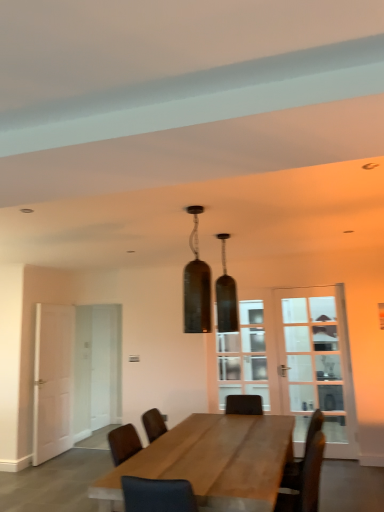
Question: Can you confirm if white glass door at left, which appears as the 1th glass door when viewed from the back, is thinner than matte glass pendant light at center, the 2th lamp in the front-to-back sequence?

Choices:
 (A) yes
 (B) no

Answer: (A)

Question: From the image's perspective, is white glass door at left, which appears as the first glass door when viewed from the left, on matte glass pendant light at center, marked as the 1th lamp in a back-to-front arrangement?

Choices:
 (A) yes
 (B) no

Answer: (B)

Question: From a real-world perspective, is white glass door at left, which is the 2th glass door from front to back, physically above matte glass pendant light at center, the 2th lamp in the front-to-back sequence?

Choices:
 (A) yes
 (B) no

Answer: (B)

Question: Is white glass door at left, which is the 2th glass door from front to back, positioned with its back to matte glass pendant light at center, marked as the 1th lamp in a back-to-front arrangement?

Choices:
 (A) no
 (B) yes

Answer: (A)

Question: Can you see white glass door at left, which is the 2th glass door from front to back, touching matte glass pendant light at center, marked as the 1th lamp in a back-to-front arrangement?

Choices:
 (A) no
 (B) yes

Answer: (A)

Question: Does white glass door at left, which appears as the first glass door when viewed from the left, appear on the left side of matte glass pendant light at center, marked as the 1th lamp in a back-to-front arrangement?

Choices:
 (A) no
 (B) yes

Answer: (B)

Question: Considering the relative sizes of matte glass pendant light at center, arranged as the first lamp when viewed from the front, and white glass door at left, arranged as the 2th glass door when viewed from the right, in the image provided, is matte glass pendant light at center, arranged as the first lamp when viewed from the front, shorter than white glass door at left, arranged as the 2th glass door when viewed from the right,?

Choices:
 (A) no
 (B) yes

Answer: (B)

Question: From a real-world perspective, is matte glass pendant light at center, the 2th lamp from the back, on white glass door at left, which appears as the 1th glass door when viewed from the back?

Choices:
 (A) no
 (B) yes

Answer: (B)

Question: Would you say white glass door at left, which appears as the first glass door when viewed from the left, is part of matte glass pendant light at center, arranged as the first lamp when viewed from the front,'s contents?

Choices:
 (A) yes
 (B) no

Answer: (B)

Question: From the image's perspective, is matte glass pendant light at center, arranged as the first lamp when viewed from the front, on white glass door at left, which appears as the first glass door when viewed from the left?

Choices:
 (A) no
 (B) yes

Answer: (B)

Question: Can you confirm if matte glass pendant light at center, the 2th lamp from the back, is wider than white glass door at left, which appears as the first glass door when viewed from the left?

Choices:
 (A) no
 (B) yes

Answer: (B)

Question: Is matte glass pendant light at center, arranged as the first lamp when viewed from the front, positioned with its back to white glass door at left, arranged as the 2th glass door when viewed from the right?

Choices:
 (A) yes
 (B) no

Answer: (B)

Question: From the image's perspective, would you say wooden table at center is positioned over clear glass door at center?

Choices:
 (A) yes
 (B) no

Answer: (B)